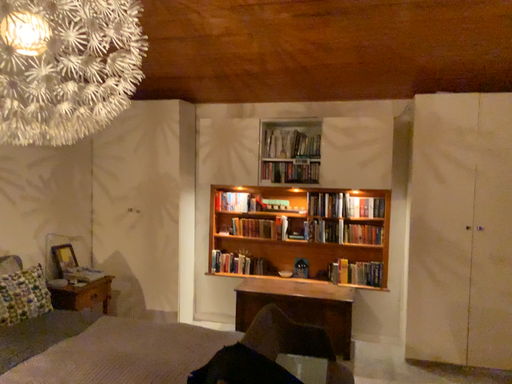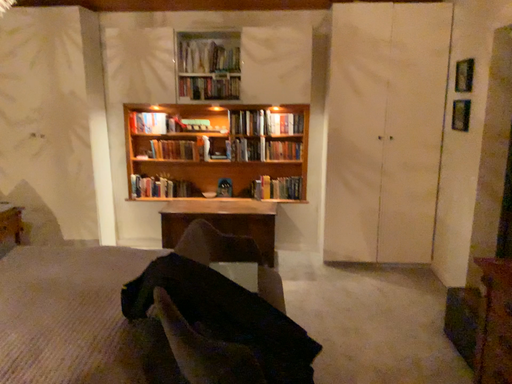
Question: How did the camera likely rotate when shooting the video?

Choices:
 (A) rotated right
 (B) rotated left

Answer: (A)